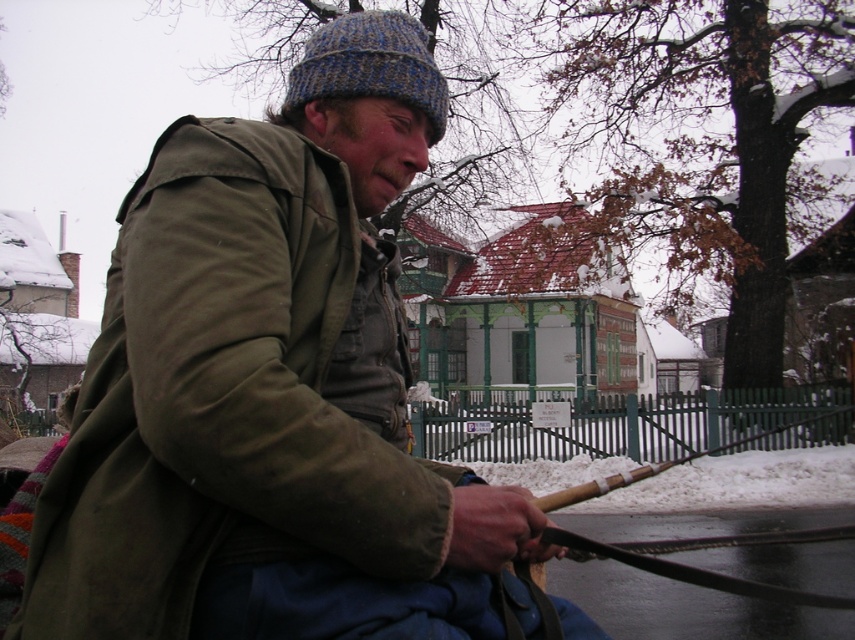
The height and width of the screenshot is (640, 855). What do you see at coordinates (228, 396) in the screenshot?
I see `olive green canvas jacket at center` at bounding box center [228, 396].

Can you confirm if olive green canvas jacket at center is smaller than knitted woolen hat at upper center?

No.

Between point (440, 465) and point (298, 88), which one is positioned behind?

The point (440, 465) is behind.

This screenshot has height=640, width=855. I want to click on olive green canvas jacket at center, so click(x=228, y=396).